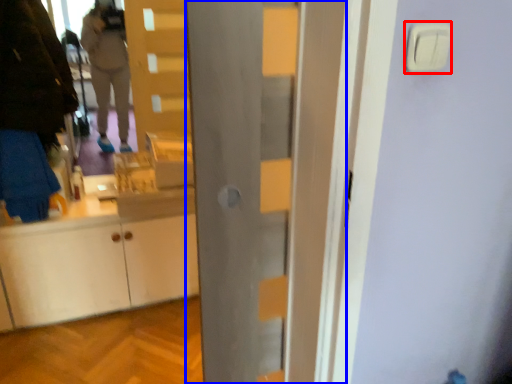
Question: Which object appears closest to the camera in this image, light switch (highlighted by a red box) or door (highlighted by a blue box)?

Choices:
 (A) light switch
 (B) door

Answer: (A)